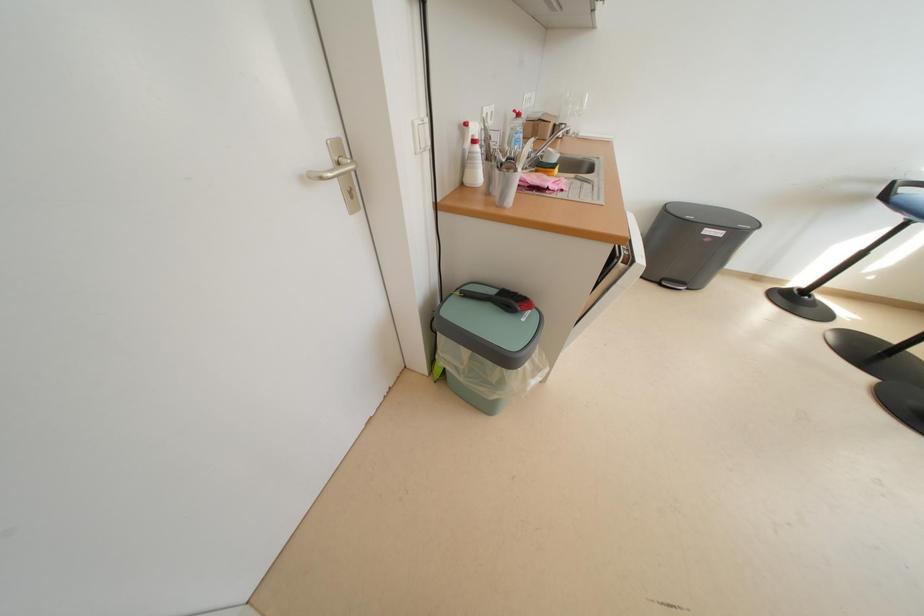
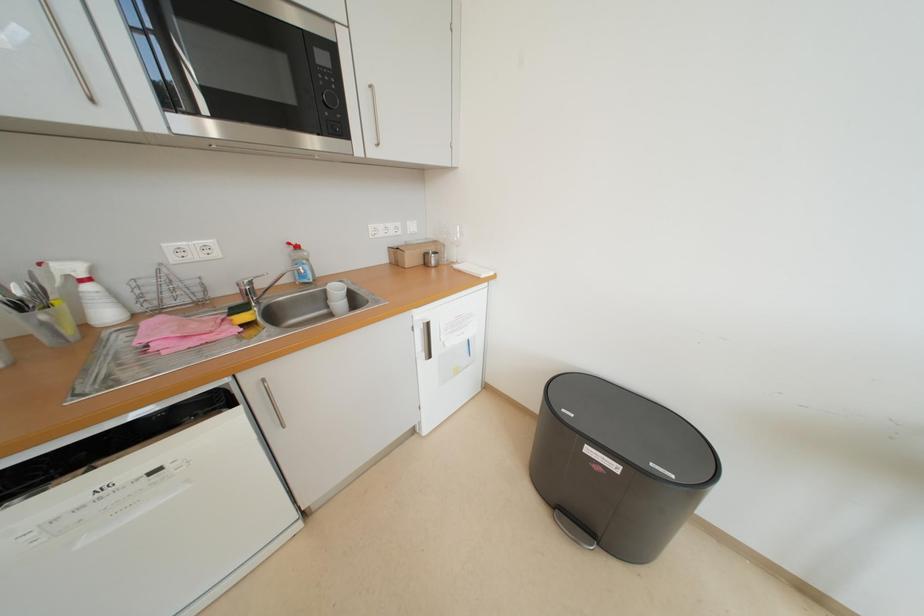
Consider the image. What movement of the cameraman would produce the second image?

The movement direction of the cameraman is right, forward.